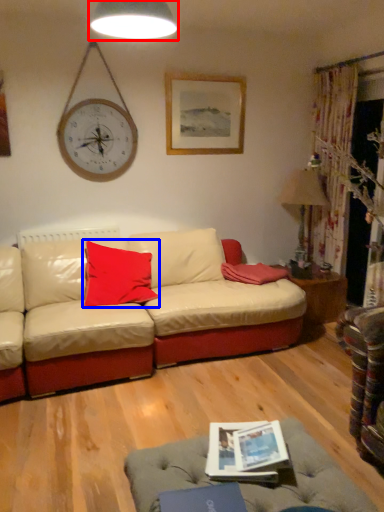
Question: Which of the following is the farthest to the observer, lamp (highlighted by a red box) or pillow (highlighted by a blue box)?

Choices:
 (A) lamp
 (B) pillow

Answer: (B)